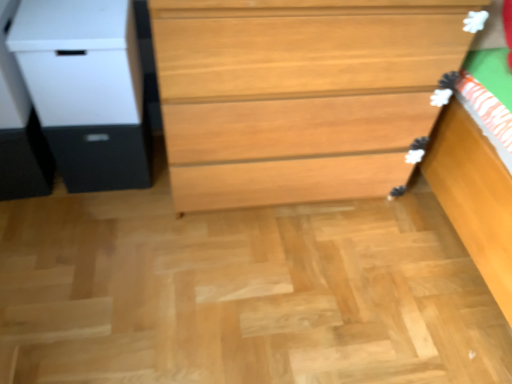
Question: From a real-world perspective, is white matte file cabinet at left physically located above or below matte black drawer at left?

Choices:
 (A) below
 (B) above

Answer: (B)

Question: In the image, is white matte file cabinet at left positioned in front of or behind matte black drawer at left?

Choices:
 (A) behind
 (B) front

Answer: (B)

Question: Considering the real-world distances, which object is closest to the light brown wood chest of drawers at center?

Choices:
 (A) matte black drawer at left
 (B) white matte file cabinet at left

Answer: (B)

Question: Which is nearer to the light brown wood chest of drawers at center?

Choices:
 (A) white matte file cabinet at left
 (B) matte black drawer at left

Answer: (A)